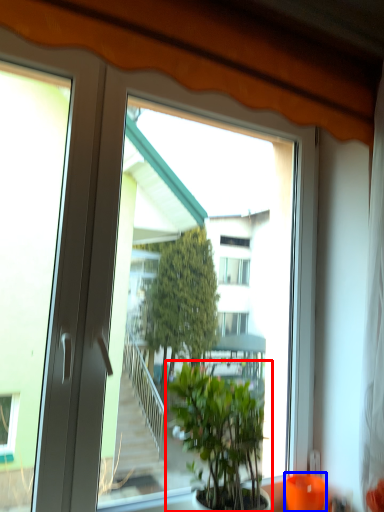
Question: Which object is closer to the camera taking this photo, houseplant (highlighted by a red box) or glass vase (highlighted by a blue box)?

Choices:
 (A) houseplant
 (B) glass vase

Answer: (A)